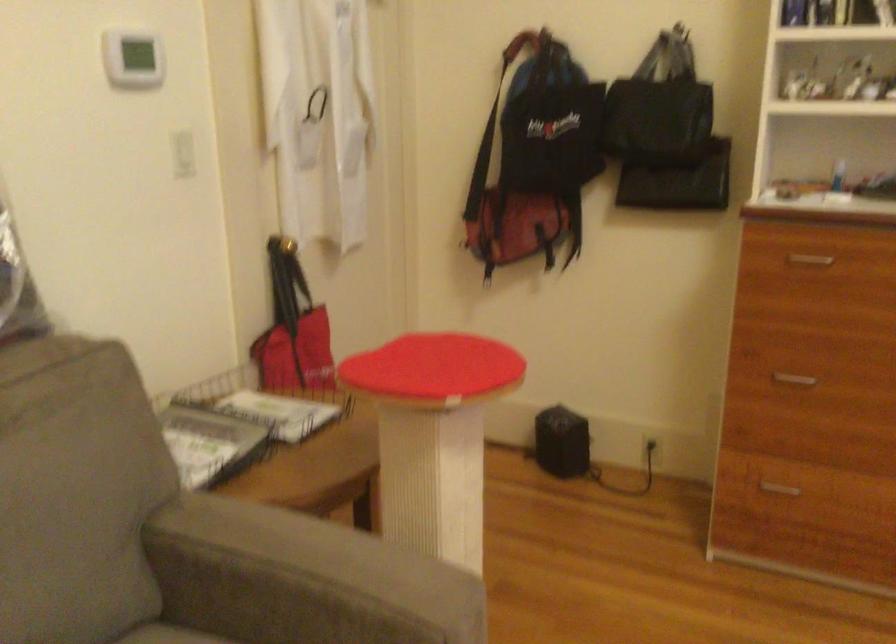
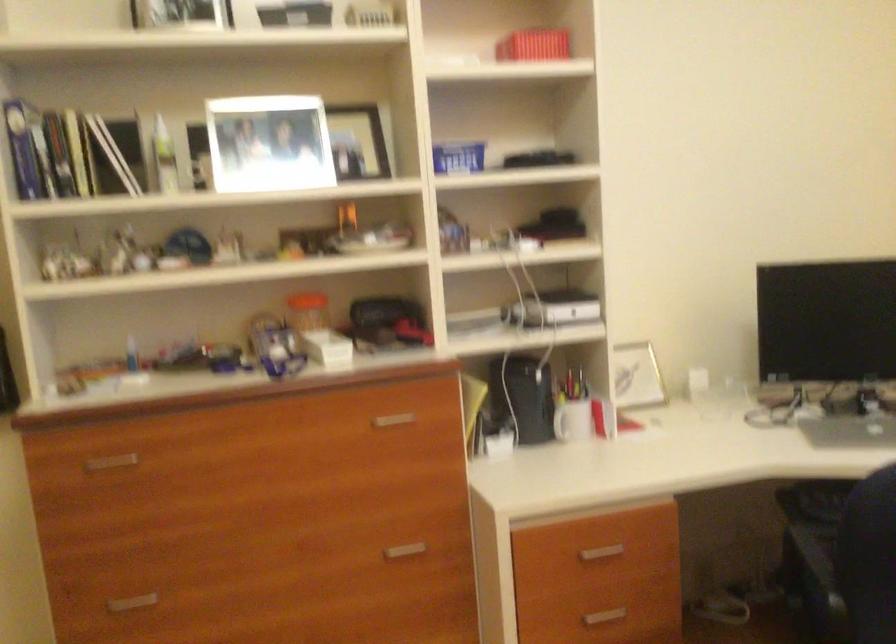
Question: The camera is either moving clockwise (left) or counter-clockwise (right) around the object. The first image is from the beginning of the video and the second image is from the end. Is the camera moving left or right when shooting the video?

Choices:
 (A) Left
 (B) Right

Answer: (A)